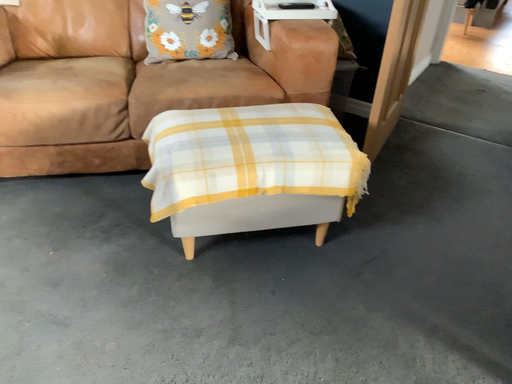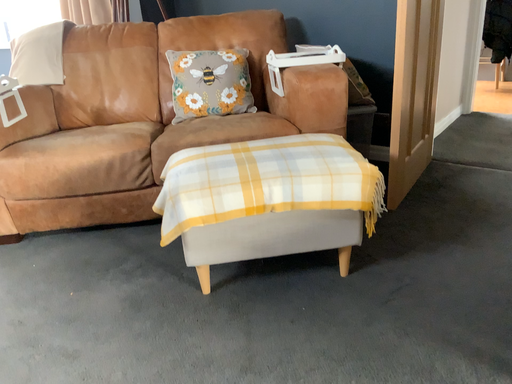
Question: How did the camera likely rotate when shooting the video?

Choices:
 (A) rotated right
 (B) rotated left

Answer: (B)